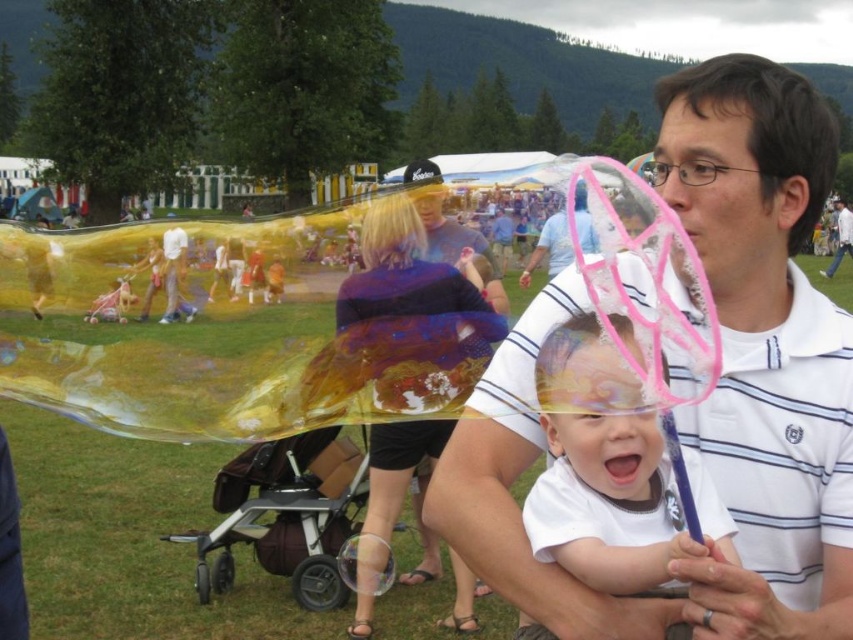
Identify the location of brown fabric stroller at lower center. The width and height of the screenshot is (853, 640). (285, 515).

Locate an element on the screen. brown fabric stroller at lower center is located at coordinates (285, 515).

This screenshot has width=853, height=640. I want to click on brown fabric stroller at lower center, so click(x=285, y=515).

Who is taller, white matte baby at center or brown fabric stroller at lower center?

brown fabric stroller at lower center

What do you see at coordinates (613, 474) in the screenshot? I see `white matte baby at center` at bounding box center [613, 474].

Where is `white matte baby at center`? white matte baby at center is located at coordinates 613,474.

Consider the image. Can you confirm if white striped shirt at center is positioned above white matte baby at center?

Indeed, white striped shirt at center is positioned over white matte baby at center.

Which is in front, point (729, 579) or point (676, 509)?

Positioned in front is point (729, 579).

Where is `white striped shirt at center`? white striped shirt at center is located at coordinates (712, 392).